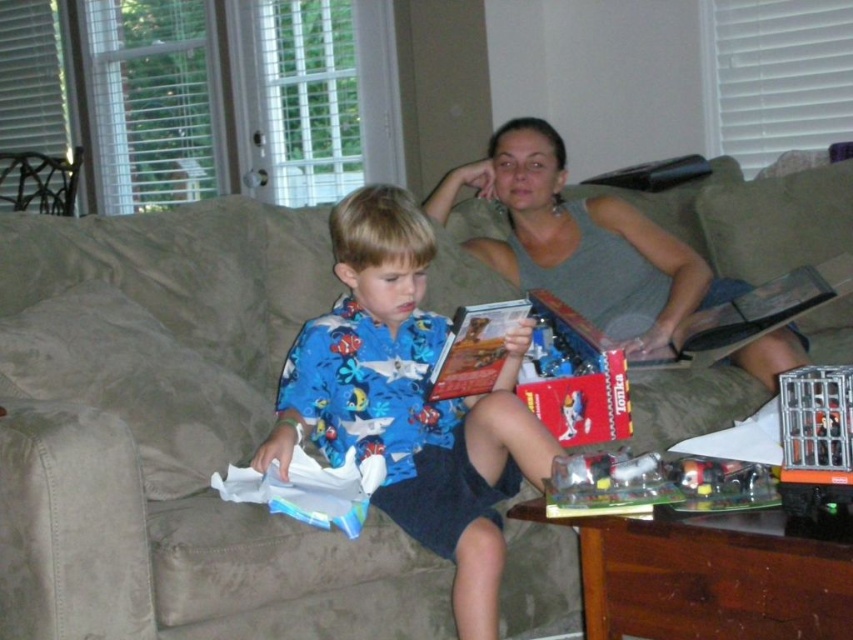
Does gray fabric couch at upper center appear on the right side of hardcover book at center?

Yes, gray fabric couch at upper center is to the right of hardcover book at center.

Does point (614, 204) come in front of point (494, 355)?

No, it is behind (494, 355).

Locate an element on the screen. This screenshot has height=640, width=853. gray fabric couch at upper center is located at coordinates 582,243.

Which is above, hardcover book at center or metallic dark brown armchair at upper left?

metallic dark brown armchair at upper left is above.

The height and width of the screenshot is (640, 853). I want to click on hardcover book at center, so click(474, 348).

Looking at this image, does blue cotton shirt at center have a larger size compared to hardcover book at center?

Yes.

Locate an element on the screen. This screenshot has height=640, width=853. blue cotton shirt at center is located at coordinates (409, 403).

Does point (335, 461) lie behind point (463, 337)?

That is True.

Find the location of a particular element. The image size is (853, 640). blue cotton shirt at center is located at coordinates (409, 403).